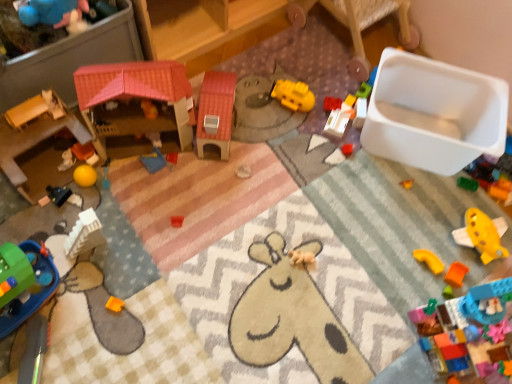
This screenshot has height=384, width=512. Find the location of `free space between matte orange blocks at left, the eleventh toy viewed from the right, and white plastic container at center, acting as the 10th toy starting from the left`. free space between matte orange blocks at left, the eleventh toy viewed from the right, and white plastic container at center, acting as the 10th toy starting from the left is located at coordinates (245, 143).